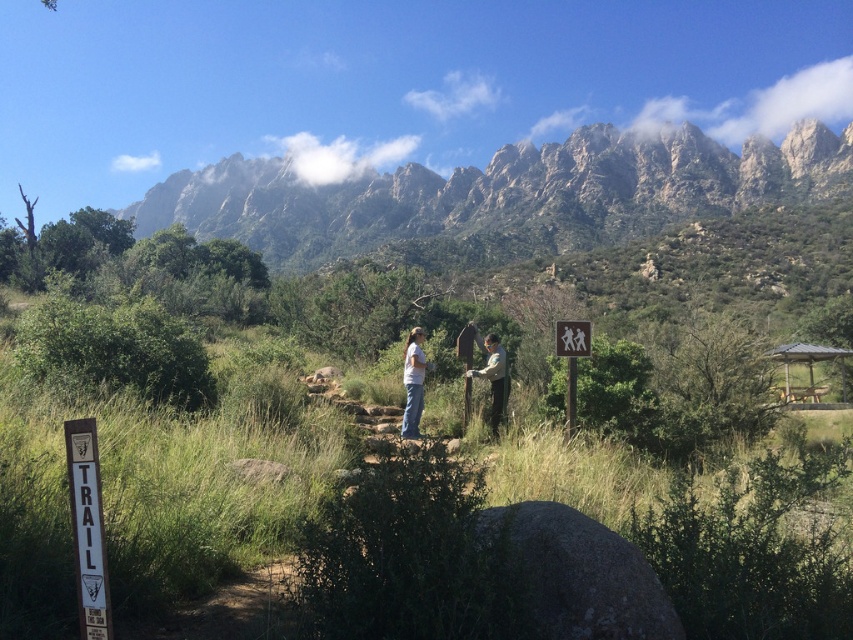
Between white cotton shirt at center and wooden signpost at center, which one is positioned lower?

white cotton shirt at center

Who is positioned more to the right, white cotton shirt at center or wooden signpost at center?

From the viewer's perspective, wooden signpost at center appears more on the right side.

The image size is (853, 640). Identify the location of white cotton shirt at center. (413, 381).

Does white wooden sign at lower left come in front of wooden signpost at center?

Yes, white wooden sign at lower left is in front of wooden signpost at center.

Is the position of white wooden sign at lower left more distant than that of wooden signpost at center?

No.

Who is more distant from viewer, (79, 588) or (585, 324)?

Positioned behind is point (585, 324).

At what (x,y) coordinates should I click in order to perform the action: click on white wooden sign at lower left. Please return your answer as a coordinate pair (x, y). Looking at the image, I should click on (86, 529).

Between white wooden sign at lower left and white cotton shirt at center, which one has less height?

With less height is white wooden sign at lower left.

What do you see at coordinates (86, 529) in the screenshot?
I see `white wooden sign at lower left` at bounding box center [86, 529].

Where is `white wooden sign at lower left`? Image resolution: width=853 pixels, height=640 pixels. white wooden sign at lower left is located at coordinates (86, 529).

The height and width of the screenshot is (640, 853). Find the location of `white wooden sign at lower left`. white wooden sign at lower left is located at coordinates (86, 529).